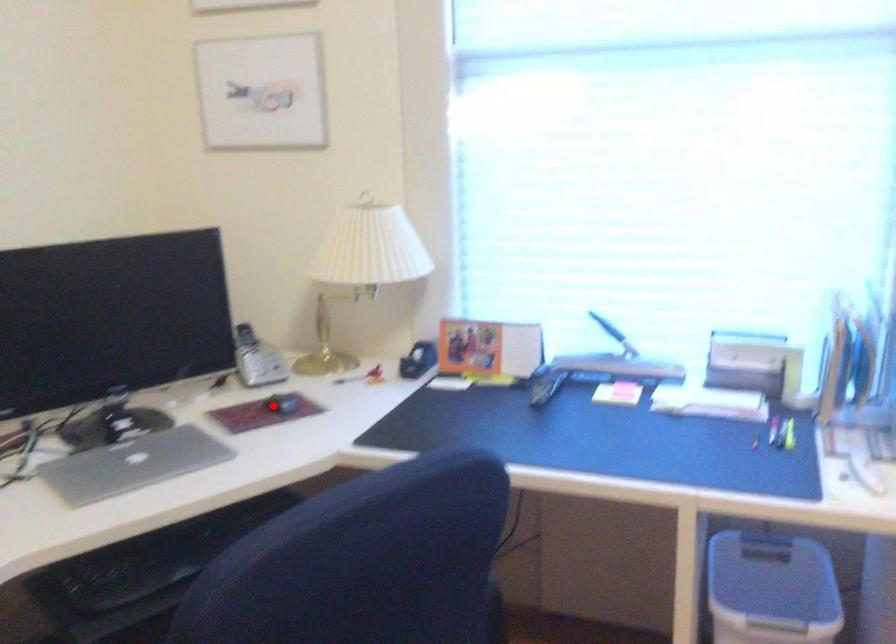
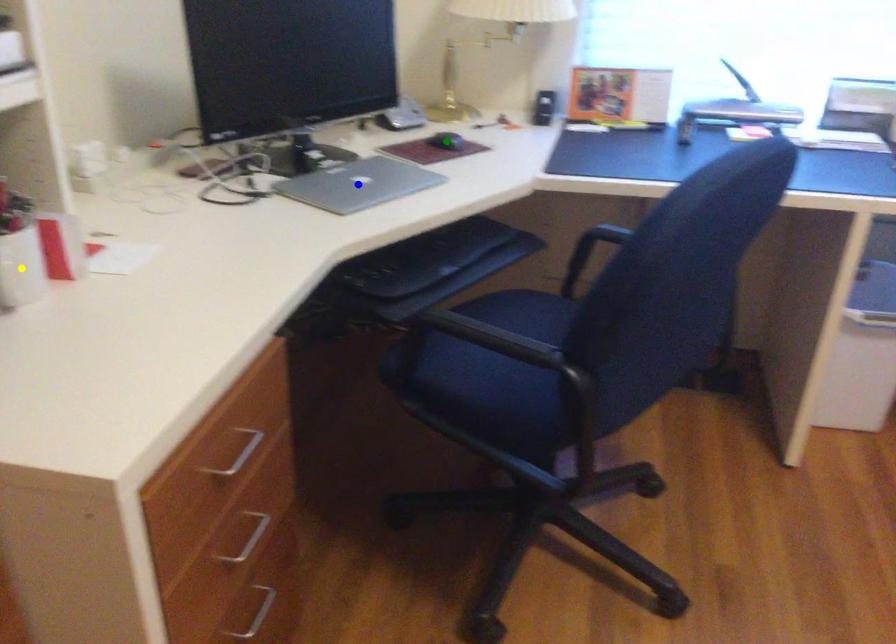
Question: I am providing you with two images of the same scene from different viewpoints. A red point is marked on the first image. You are given multiple points on the second image. Which spot in image 2 lines up with the point in image 1?

Choices:
 (A) green point
 (B) yellow point
 (C) blue point

Answer: (A)